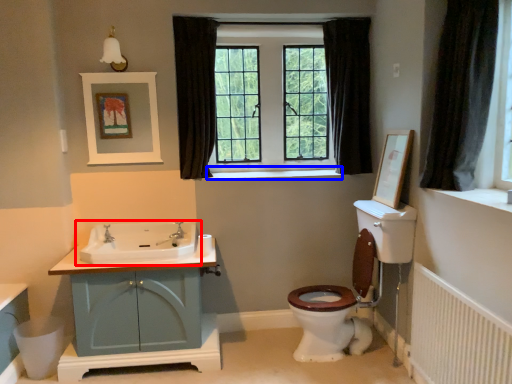
Question: Which object appears closest to the camera in this image, sink (highlighted by a red box) or window sill (highlighted by a blue box)?

Choices:
 (A) sink
 (B) window sill

Answer: (A)